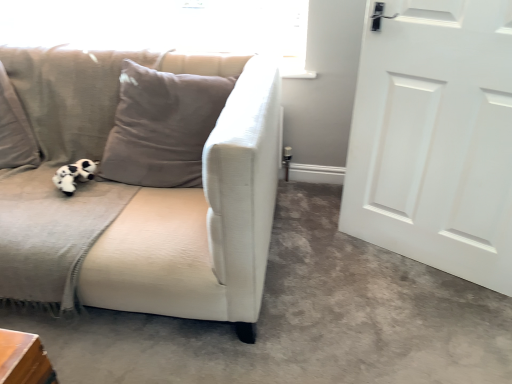
Question: Is black plush toy at left positioned with its back to white matte door at right?

Choices:
 (A) yes
 (B) no

Answer: (B)

Question: From a real-world perspective, does black plush toy at left stand above white matte door at right?

Choices:
 (A) yes
 (B) no

Answer: (B)

Question: Is black plush toy at left not close to white matte door at right?

Choices:
 (A) no
 (B) yes

Answer: (B)

Question: Does black plush toy at left appear on the left side of white matte door at right?

Choices:
 (A) no
 (B) yes

Answer: (B)

Question: From a real-world perspective, is black plush toy at left positioned under white matte door at right based on gravity?

Choices:
 (A) no
 (B) yes

Answer: (B)

Question: Is black plush toy at left touching white matte door at right?

Choices:
 (A) yes
 (B) no

Answer: (B)

Question: Considering the relative sizes of beige fabric couch at left and white fabric couch at left in the image provided, is beige fabric couch at left bigger than white fabric couch at left?

Choices:
 (A) no
 (B) yes

Answer: (B)

Question: Is beige fabric couch at left positioned with its back to white fabric couch at left?

Choices:
 (A) yes
 (B) no

Answer: (B)

Question: Is beige fabric couch at left positioned before white fabric couch at left?

Choices:
 (A) no
 (B) yes

Answer: (B)

Question: From a real-world perspective, is beige fabric couch at left under white fabric couch at left?

Choices:
 (A) yes
 (B) no

Answer: (B)

Question: Does beige fabric couch at left lie behind white fabric couch at left?

Choices:
 (A) no
 (B) yes

Answer: (A)

Question: From the image's perspective, is beige fabric couch at left beneath white fabric couch at left?

Choices:
 (A) yes
 (B) no

Answer: (B)

Question: From a real-world perspective, is white fabric couch at left beneath transparent glass window screen at upper left?

Choices:
 (A) yes
 (B) no

Answer: (A)